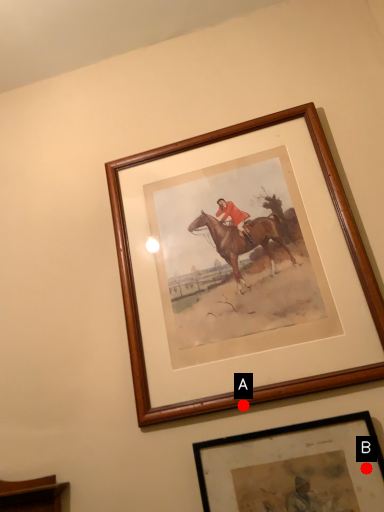
Question: Two points are circled on the image, labeled by A and B beside each circle. Which of the following is the closest to the observer?

Choices:
 (A) A is closer
 (B) B is closer

Answer: (B)